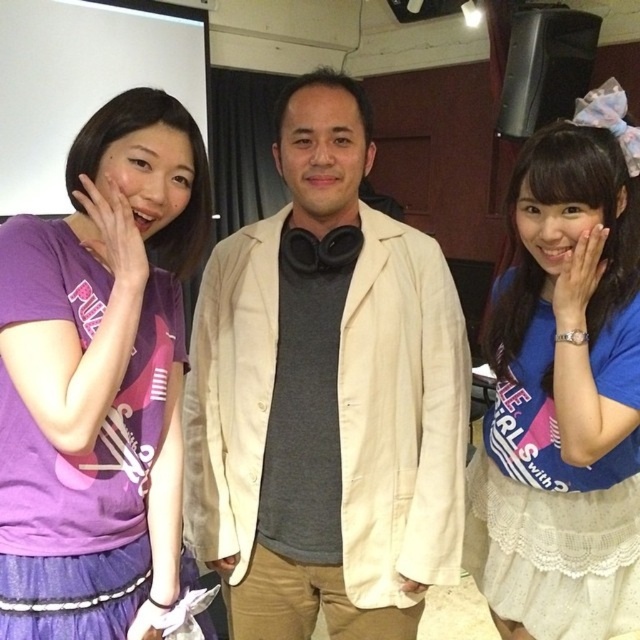
Question: Which of the following is the farthest from the observer?

Choices:
 (A) (172, 344)
 (B) (486, 532)
 (C) (348, 115)

Answer: (B)

Question: Among these objects, which one is nearest to the camera?

Choices:
 (A) purple matte t-shirt at left
 (B) beige fabric jacket at center
 (C) blue fabric shirt at center

Answer: (A)

Question: Considering the relative positions of purple matte t-shirt at left and blue fabric shirt at center in the image provided, where is purple matte t-shirt at left located with respect to blue fabric shirt at center?

Choices:
 (A) right
 (B) left

Answer: (B)

Question: Which point is farther to the camera?

Choices:
 (A) (147, 468)
 (B) (349, 392)

Answer: (B)

Question: Can you confirm if purple matte t-shirt at left is bigger than blue fabric shirt at center?

Choices:
 (A) yes
 (B) no

Answer: (B)

Question: Is beige fabric jacket at center to the right of purple matte t-shirt at left from the viewer's perspective?

Choices:
 (A) yes
 (B) no

Answer: (A)